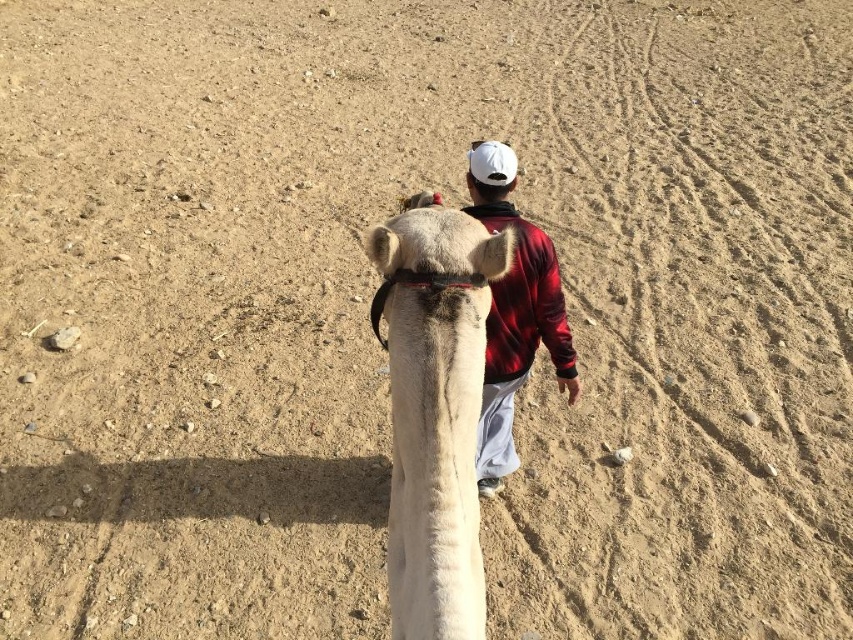
Question: Can you confirm if fuzzy beige camel at center is positioned to the right of red plaid jacket at center?

Choices:
 (A) yes
 (B) no

Answer: (B)

Question: From the image, what is the correct spatial relationship of fuzzy beige camel at center in relation to white matte baseball hat at upper center?

Choices:
 (A) right
 (B) left

Answer: (B)

Question: Is the position of fuzzy beige camel at center less distant than that of red plaid jacket at center?

Choices:
 (A) yes
 (B) no

Answer: (A)

Question: Which object is positioned farthest from the fuzzy beige camel at center?

Choices:
 (A) red plaid jacket at center
 (B) white matte baseball hat at upper center

Answer: (B)

Question: Among these points, which one is nearest to the camera?

Choices:
 (A) (480, 144)
 (B) (405, 253)
 (C) (517, 348)

Answer: (B)

Question: Which object is positioned farthest from the fuzzy beige camel at center?

Choices:
 (A) white matte baseball hat at upper center
 (B) red plaid jacket at center

Answer: (A)